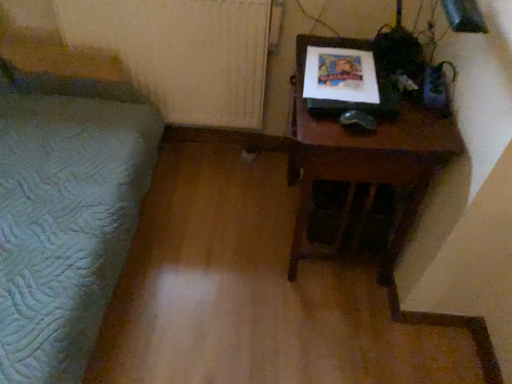
Question: In terms of size, does white textured radiator at upper left appear bigger or smaller than green quilted bedspread at left?

Choices:
 (A) big
 (B) small

Answer: (B)

Question: Visually, is white textured radiator at upper left positioned to the left or to the right of green quilted bedspread at left?

Choices:
 (A) right
 (B) left

Answer: (A)

Question: Estimate the real-world distances between objects in this image. Which object is farther from the green quilted bedspread at left?

Choices:
 (A) wooden table at right
 (B) white textured radiator at upper left

Answer: (A)

Question: Which is nearer to the green quilted bedspread at left?

Choices:
 (A) wooden table at right
 (B) white textured radiator at upper left

Answer: (B)